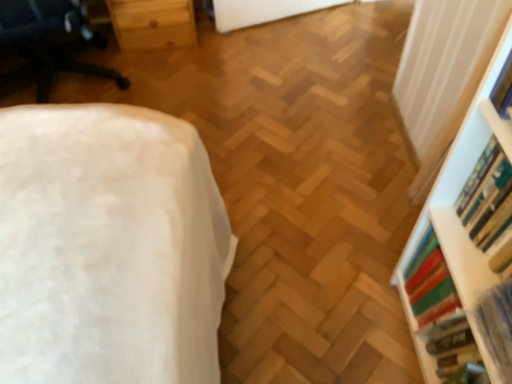
What do you see at coordinates (464, 243) in the screenshot? I see `white plastic shelf at right` at bounding box center [464, 243].

Identify the location of hardcover book at upper right, arranged as the 1th book when viewed from the top. The image size is (512, 384). (503, 89).

Image resolution: width=512 pixels, height=384 pixels. Describe the element at coordinates (437, 311) in the screenshot. I see `hardcover book at right, the 3th book positioned from the top` at that location.

You are a GUI agent. You are given a task and a screenshot of the screen. Output one action in this format:
    pyautogui.click(x=<x>, y=<y>)
    Task: Click on the white plastic shelf at right
    The width and height of the screenshot is (512, 384).
    Given the screenshot: What is the action you would take?
    (x=464, y=243)

Considering the relative positions of hardcover book at upper right, arranged as the 1th book when viewed from the top, and white plastic shelf at right in the image provided, is hardcover book at upper right, arranged as the 1th book when viewed from the top, behind white plastic shelf at right?

Yes, hardcover book at upper right, arranged as the 1th book when viewed from the top, is behind white plastic shelf at right.

Which of these two, hardcover book at upper right, which is the 4th book from bottom to top, or white plastic shelf at right, stands taller?

white plastic shelf at right is taller.

Which of these two, hardcover book at upper right, arranged as the 1th book when viewed from the top, or white plastic shelf at right, is wider?

Wider between the two is white plastic shelf at right.

What's the angular difference between hardcover book at upper right, arranged as the 1th book when viewed from the top, and white plastic shelf at right's facing directions?

The facing directions of hardcover book at upper right, arranged as the 1th book when viewed from the top, and white plastic shelf at right are 1.24 degrees apart.

Does hardcover book at right, positioned as the 4th book in top-to-bottom order, appear on the left side of hardcover book at right, acting as the 2th book starting from the top?

Indeed, hardcover book at right, positioned as the 4th book in top-to-bottom order, is positioned on the left side of hardcover book at right, acting as the 2th book starting from the top.

Which object is wider, hardcover book at right, which is the first book in bottom-to-top order, or hardcover book at right, the third book when ordered from bottom to top?

hardcover book at right, which is the first book in bottom-to-top order, is wider.

From the image's perspective, which one is positioned higher, hardcover book at right, positioned as the 4th book in top-to-bottom order, or hardcover book at right, acting as the 2th book starting from the top?

hardcover book at right, acting as the 2th book starting from the top, is shown above in the image.

Could you measure the distance between hardcover book at right, positioned as the 4th book in top-to-bottom order, and hardcover book at right, the third book when ordered from bottom to top?

7.05 inches.

From the image's perspective, which one is positioned lower, hardcover book at right, the 3th book positioned from the top, or hardcover book at right, the third book when ordered from bottom to top?

From the image's view, hardcover book at right, the 3th book positioned from the top, is below.

Considering the positions of point (412, 265) and point (476, 164), is point (412, 265) closer or farther from the camera than point (476, 164)?

Point (412, 265).

Looking at the image, does hardcover book at right, marked as the 2th book in a bottom-to-top arrangement, seem bigger or smaller compared to hardcover book at right, acting as the 2th book starting from the top?

hardcover book at right, marked as the 2th book in a bottom-to-top arrangement, is bigger than hardcover book at right, acting as the 2th book starting from the top.

I want to click on the 1st book below the hardcover book at upper right, arranged as the 1th book when viewed from the top (from a real-world perspective), so (486, 196).

Choose the correct answer: Is hardcover book at upper right, which is the 4th book from bottom to top, inside hardcover book at right, acting as the 2th book starting from the top, or outside it?

hardcover book at upper right, which is the 4th book from bottom to top, is spatially situated outside hardcover book at right, acting as the 2th book starting from the top.

Considering the sizes of objects hardcover book at upper right, arranged as the 1th book when viewed from the top, and hardcover book at right, the third book when ordered from bottom to top, in the image provided, who is bigger, hardcover book at upper right, arranged as the 1th book when viewed from the top, or hardcover book at right, the third book when ordered from bottom to top,?

hardcover book at right, the third book when ordered from bottom to top, is bigger.

Does hardcover book at upper right, which is the 4th book from bottom to top, turn towards hardcover book at right, acting as the 2th book starting from the top?

No, hardcover book at upper right, which is the 4th book from bottom to top, is not aimed at hardcover book at right, acting as the 2th book starting from the top.

Could you tell me if white fabric ottoman at left is turned towards hardcover book at right, the 3th book positioned from the top?

No, white fabric ottoman at left does not turn towards hardcover book at right, the 3th book positioned from the top.

Does white fabric ottoman at left have a lesser width compared to hardcover book at right, marked as the 2th book in a bottom-to-top arrangement?

No, white fabric ottoman at left is not thinner than hardcover book at right, marked as the 2th book in a bottom-to-top arrangement.

From a real-world perspective, is white fabric ottoman at left beneath hardcover book at right, the 3th book positioned from the top?

No.

Based on the photo, are white fabric ottoman at left and hardcover book at right, the 3th book positioned from the top, making contact?

They are not placed beside each other.

Considering the sizes of objects white fabric ottoman at left and hardcover book at right, acting as the 2th book starting from the top, in the image provided, who is bigger, white fabric ottoman at left or hardcover book at right, acting as the 2th book starting from the top,?

white fabric ottoman at left.

From the image's perspective, is white fabric ottoman at left under hardcover book at right, acting as the 2th book starting from the top?

No.

This screenshot has width=512, height=384. I want to click on furniture on the left of hardcover book at right, the third book when ordered from bottom to top, so click(x=47, y=41).

From a real-world perspective, which is physically below, white fabric ottoman at left or hardcover book at right, the third book when ordered from bottom to top?

In real-world perspective, white fabric ottoman at left is lower.

Find the location of a particular element. the 1st book counting from the right side of the hardcover book at right, positioned as the 4th book in top-to-bottom order is located at coordinates (437, 311).

How many degrees apart are the facing directions of hardcover book at right, positioned as the 4th book in top-to-bottom order, and hardcover book at right, marked as the 2th book in a bottom-to-top arrangement?

The angular difference between hardcover book at right, positioned as the 4th book in top-to-bottom order, and hardcover book at right, marked as the 2th book in a bottom-to-top arrangement, is 4.57 degrees.

Is hardcover book at right, which is the first book in bottom-to-top order, behind hardcover book at right, the 3th book positioned from the top?

No, the depth of hardcover book at right, which is the first book in bottom-to-top order, is less than that of hardcover book at right, the 3th book positioned from the top.

Would you say hardcover book at right, the 3th book positioned from the top, is part of hardcover book at right, positioned as the 4th book in top-to-bottom order,'s contents?

That's incorrect, hardcover book at right, the 3th book positioned from the top, is not inside hardcover book at right, positioned as the 4th book in top-to-bottom order.

From the image's perspective, which book is the 2nd one above the white plastic shelf at right? Please provide its 2D coordinates.

[(503, 89)]

Where is `the 1st book behind the hardcover book at right, which is the first book in bottom-to-top order`? Image resolution: width=512 pixels, height=384 pixels. the 1st book behind the hardcover book at right, which is the first book in bottom-to-top order is located at coordinates (486, 196).

Which object lies further to the anchor point hardcover book at upper right, which is the 4th book from bottom to top, hardcover book at right, acting as the 2th book starting from the top, or white fabric ottoman at left?

white fabric ottoman at left lies further to hardcover book at upper right, which is the 4th book from bottom to top, than the other object.

Which object lies nearer to the anchor point hardcover book at right, positioned as the 4th book in top-to-bottom order, white plastic shelf at right or white fabric ottoman at left?

white plastic shelf at right lies closer to hardcover book at right, positioned as the 4th book in top-to-bottom order, than the other object.

Which object lies nearer to the anchor point hardcover book at right, acting as the 2th book starting from the top, hardcover book at upper right, which is the 4th book from bottom to top, or white fabric ottoman at left?

hardcover book at upper right, which is the 4th book from bottom to top.

From the image, which object appears to be nearer to hardcover book at right, which is the first book in bottom-to-top order, white fabric ottoman at left or hardcover book at upper right, arranged as the 1th book when viewed from the top?

hardcover book at upper right, arranged as the 1th book when viewed from the top, lies closer to hardcover book at right, which is the first book in bottom-to-top order, than the other object.

Looking at the image, which one is located further to hardcover book at right, the 3th book positioned from the top, white fabric ottoman at left or hardcover book at upper right, which is the 4th book from bottom to top?

The object further to hardcover book at right, the 3th book positioned from the top, is white fabric ottoman at left.

Based on their spatial positions, is white fabric ottoman at left or hardcover book at right, which is the first book in bottom-to-top order, further from white plastic shelf at right?

Based on the image, white fabric ottoman at left appears to be further to white plastic shelf at right.

Estimate the real-world distances between objects in this image. Which object is further from white fabric ottoman at left, hardcover book at right, which is the first book in bottom-to-top order, or white plastic shelf at right?

Based on the image, hardcover book at right, which is the first book in bottom-to-top order, appears to be further to white fabric ottoman at left.

Consider the image. Based on their spatial positions, is hardcover book at right, positioned as the 4th book in top-to-bottom order, or hardcover book at upper right, arranged as the 1th book when viewed from the top, further from white fabric ottoman at left?

Among the two, hardcover book at right, positioned as the 4th book in top-to-bottom order, is located further to white fabric ottoman at left.

At what (x,y) coordinates should I click in order to perform the action: click on book between hardcover book at upper right, which is the 4th book from bottom to top, and hardcover book at right, marked as the 2th book in a bottom-to-top arrangement, from top to bottom. Please return your answer as a coordinate pair (x, y). Looking at the image, I should click on click(486, 196).

Locate an element on the screen. This screenshot has width=512, height=384. shelf that lies between hardcover book at upper right, which is the 4th book from bottom to top, and hardcover book at right, the 3th book positioned from the top, from top to bottom is located at coordinates (464, 243).

I want to click on book between hardcover book at upper right, arranged as the 1th book when viewed from the top, and white plastic shelf at right from top to bottom, so click(486, 196).

Identify the location of book between hardcover book at right, acting as the 2th book starting from the top, and hardcover book at right, positioned as the 4th book in top-to-bottom order, vertically. The height and width of the screenshot is (384, 512). click(x=437, y=311).